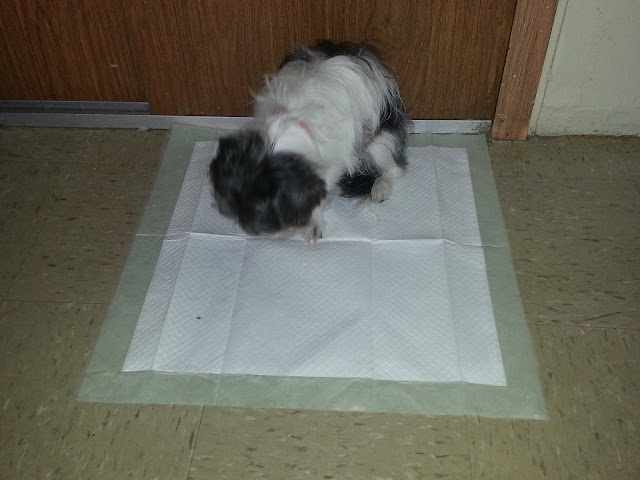
Where is `bottom left of pee pad`? The width and height of the screenshot is (640, 480). bottom left of pee pad is located at coordinates (80, 401).